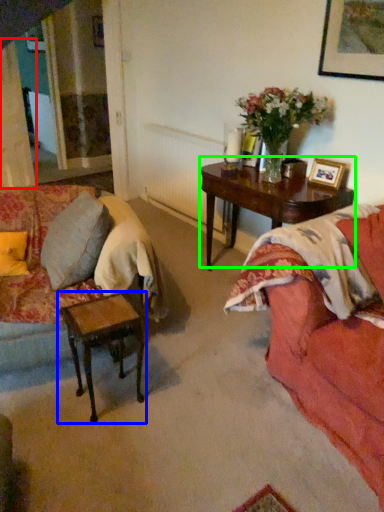
Question: Which object is the closest to the curtain (highlighted by a red box)? Choose among these: table (highlighted by a blue box) or coffee table (highlighted by a green box).

Choices:
 (A) table
 (B) coffee table

Answer: (B)